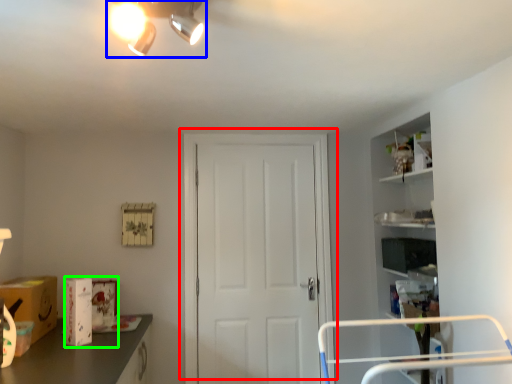
Question: Which object is the farthest from door (highlighted by a red box)? Choose among these: light fixture (highlighted by a blue box) or box (highlighted by a green box).

Choices:
 (A) light fixture
 (B) box

Answer: (A)